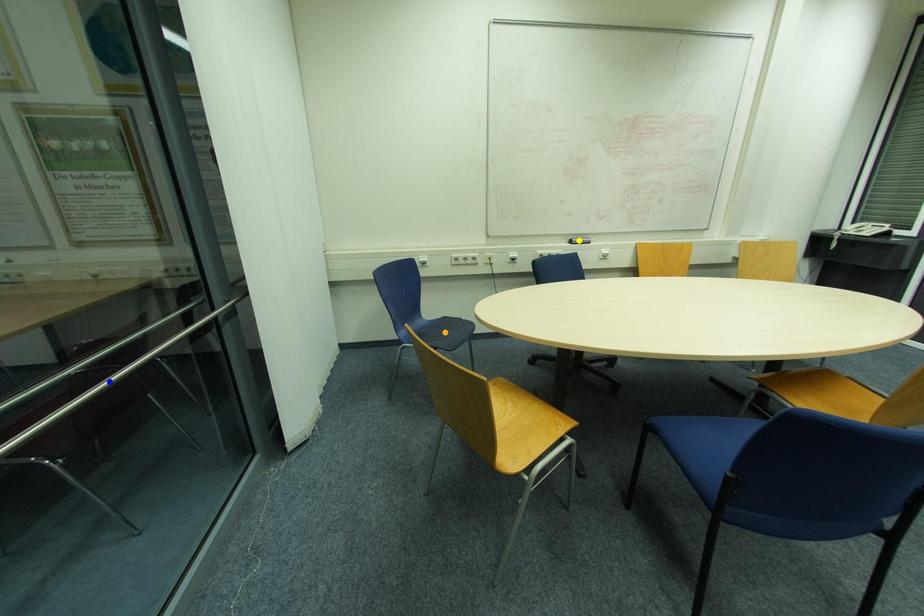
Order these from nearest to farthest:
blue point, orange point, yellow point

yellow point
orange point
blue point